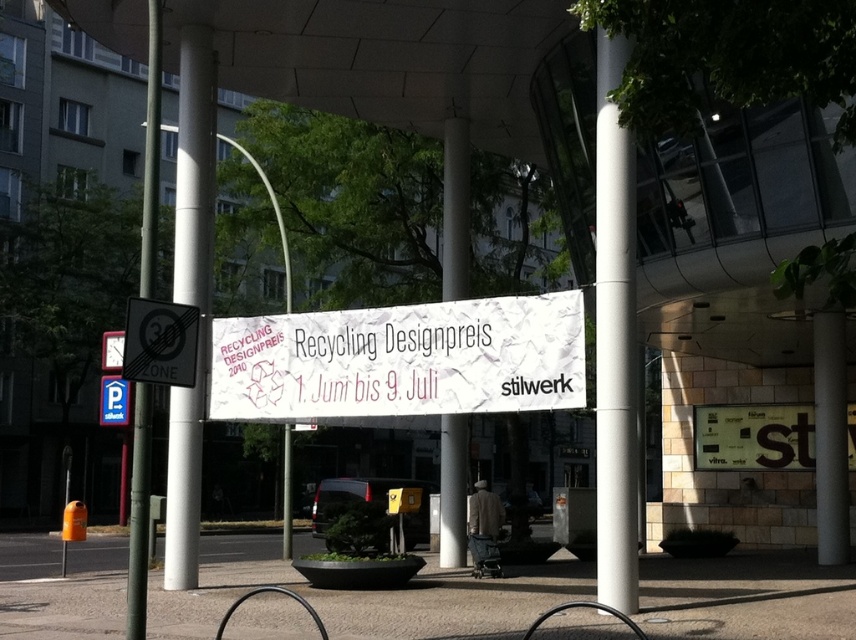
Question: Does white paper banner at center appear over white glossy pillar at left?

Choices:
 (A) no
 (B) yes

Answer: (A)

Question: Among these points, which one is farthest from the camera?

Choices:
 (A) (185, 317)
 (B) (287, 424)
 (C) (206, 317)

Answer: (B)

Question: Observing the image, what is the correct spatial positioning of green metallic pole at left in reference to white glossy pillar at center?

Choices:
 (A) above
 (B) below

Answer: (A)

Question: Which is nearer to the white smooth pole at center?

Choices:
 (A) white smooth pillar at center
 (B) white glossy pillar at left
 (C) black reflective zone sign at left
 (D) white glossy pillar at center

Answer: (D)

Question: Does white paper banner at center lie behind metallic pole at center?

Choices:
 (A) yes
 (B) no

Answer: (B)

Question: Which object is positioned closest to the metallic pole at center?

Choices:
 (A) white glossy pillar at center
 (B) white glossy pillar at left
 (C) green metallic pole at left
 (D) white paper banner at center

Answer: (B)